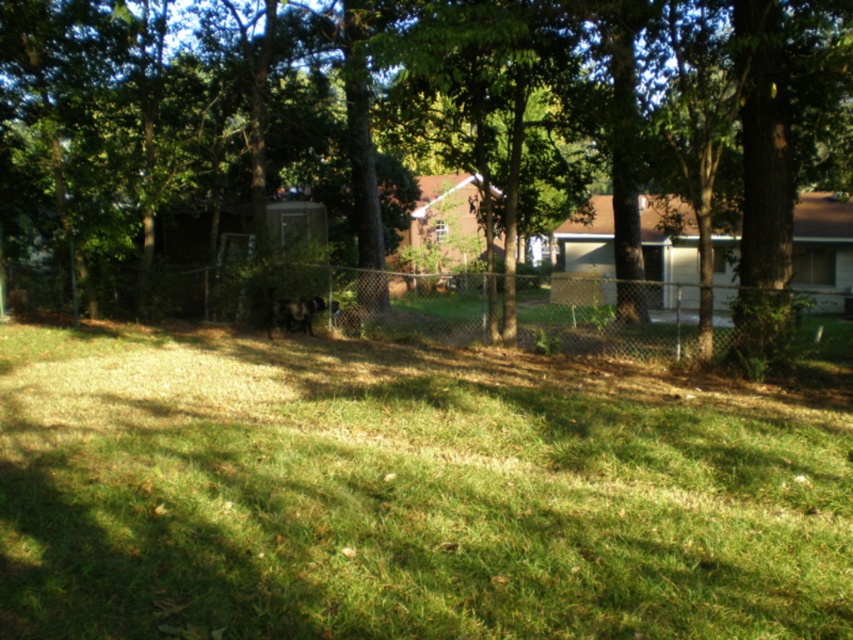
You are a gardener who wants to install a sprinkler system to water both the green grassy at center and the green leafy tree at center. The sprinkler system has a maximum range of 10 meters. Can you water both areas with the same sprinkler system?

The distance between the green grassy at center and the green leafy tree at center is 12.51 meters, which exceeds the sprinkler system range of 10 meters. Therefore, the sprinkler system cannot water both areas simultaneously.